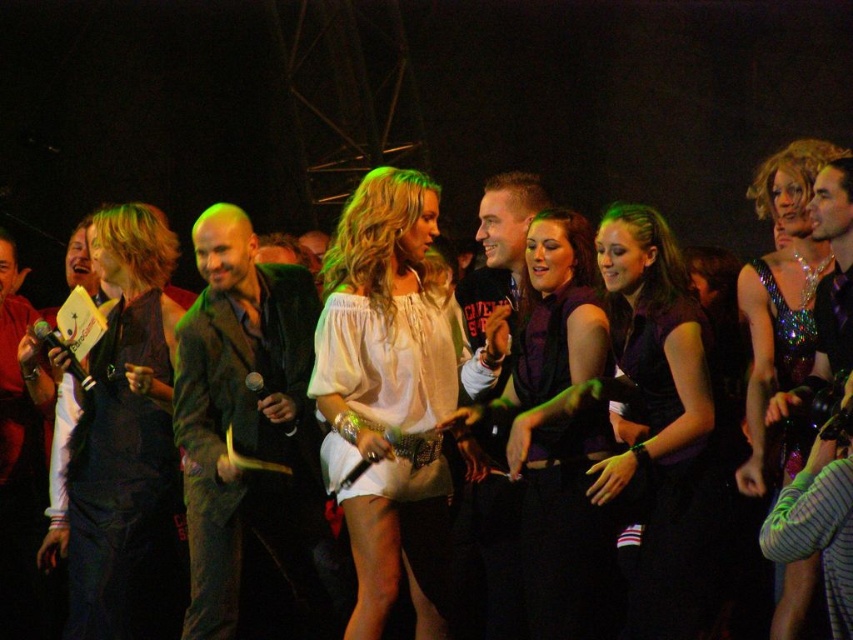
You are standing at the origin point of the coordinate system in the image. The image has a coordinate system where the bottom left corner is the origin point. You need to move to the matte black dress at center. In which direction should you move? Please provide your answer as a coordinate direction, such as up, down, right, left, northeast, etc.

The matte black dress at center is located at coordinate point 0.684 on the x axis and 0.655 on the y axis. Since the origin point is at the bottom left corner, moving towards higher x values means moving to the right, and higher y values mean moving upward. Therefore, to reach the matte black dress at center, you should move to the right and upward from the origin point.

You are a photographer at the event and want to capture both the velvet green jacket at center and the sparkly sequined dress at center in a single frame. Which object should you focus on first to ensure both are in the frame?

The velvet green jacket at center is taller than the sparkly sequined dress at center, so focusing on the velvet green jacket at center first will help ensure both are captured in the frame.